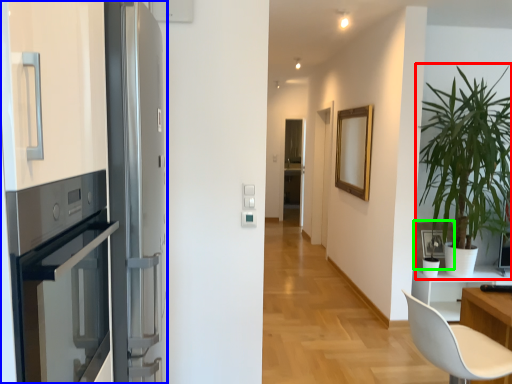
Question: Considering the real-world distances, which object is farthest from houseplant (highlighted by a red box)? fridge (highlighted by a blue box) or picture frame (highlighted by a green box)?

Choices:
 (A) fridge
 (B) picture frame

Answer: (A)